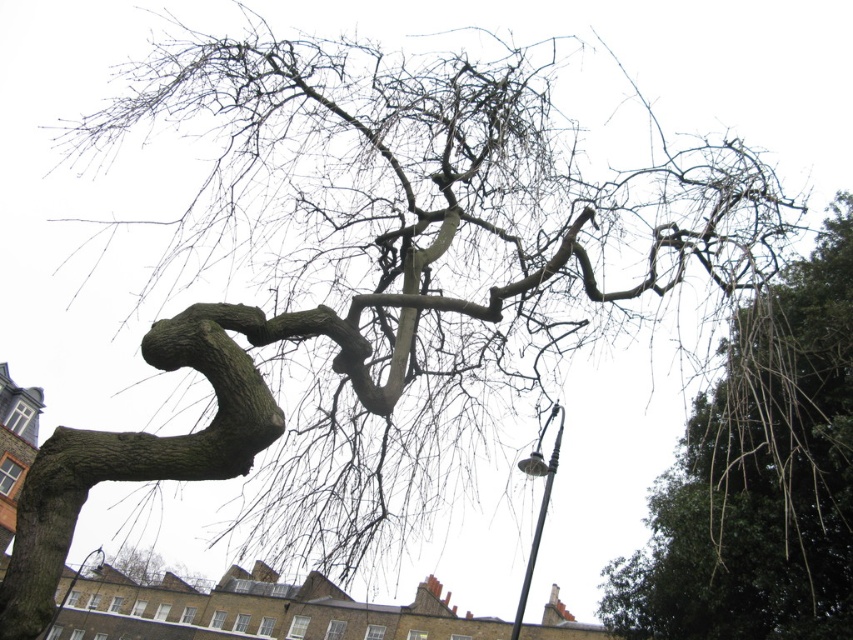
Question: Does black metal streetlight at lower right have a greater width compared to metallic gray lamp post at lower left?

Choices:
 (A) no
 (B) yes

Answer: (A)

Question: Which point is farther from the camera taking this photo?

Choices:
 (A) (70, 580)
 (B) (538, 458)
 (C) (844, 470)

Answer: (A)

Question: Is bare branches at upper right above black metal streetlight at lower right?

Choices:
 (A) no
 (B) yes

Answer: (B)

Question: Which object is the closest to the black metal streetlight at lower right?

Choices:
 (A) bare branches at upper right
 (B) metallic gray lamp post at lower left

Answer: (A)

Question: Does black metal streetlight at lower right have a lesser width compared to metallic gray lamp post at lower left?

Choices:
 (A) no
 (B) yes

Answer: (B)

Question: Estimate the real-world distances between objects in this image. Which object is farther from the metallic gray lamp post at lower left?

Choices:
 (A) bare branches at upper right
 (B) black metal streetlight at lower right

Answer: (B)